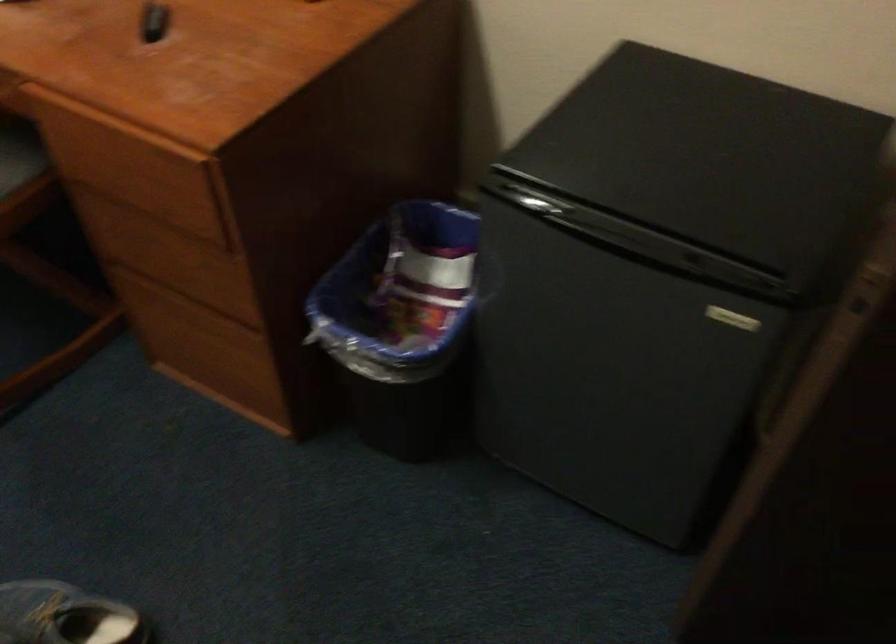
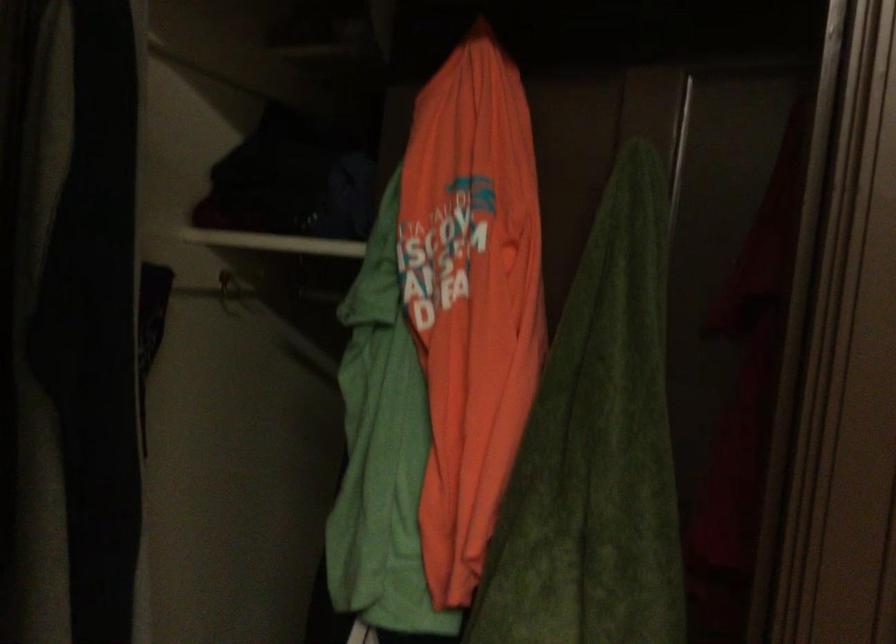
Looking at this image, the images are taken continuously from a first-person perspective. In which direction is your viewpoint rotating?

The camera's rotation is toward right-down.